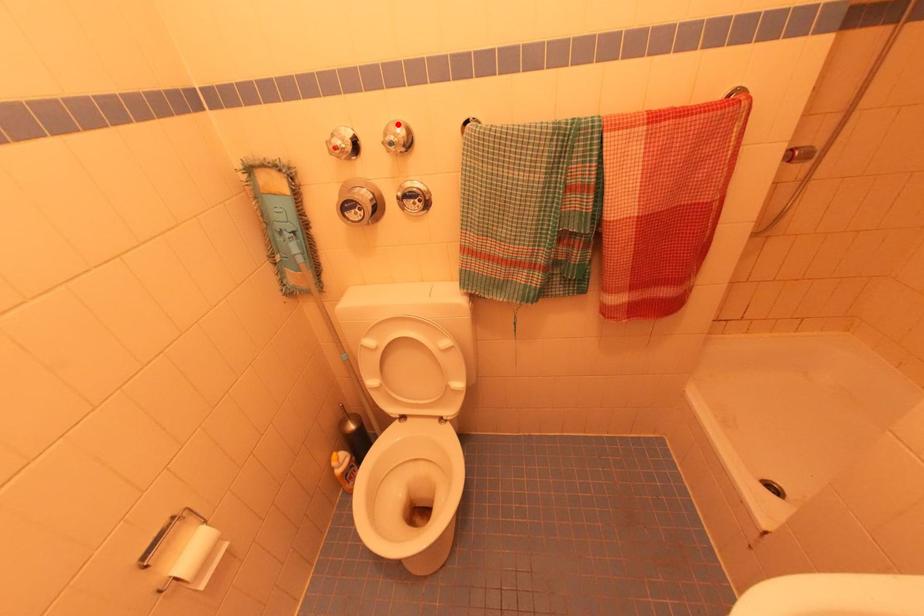
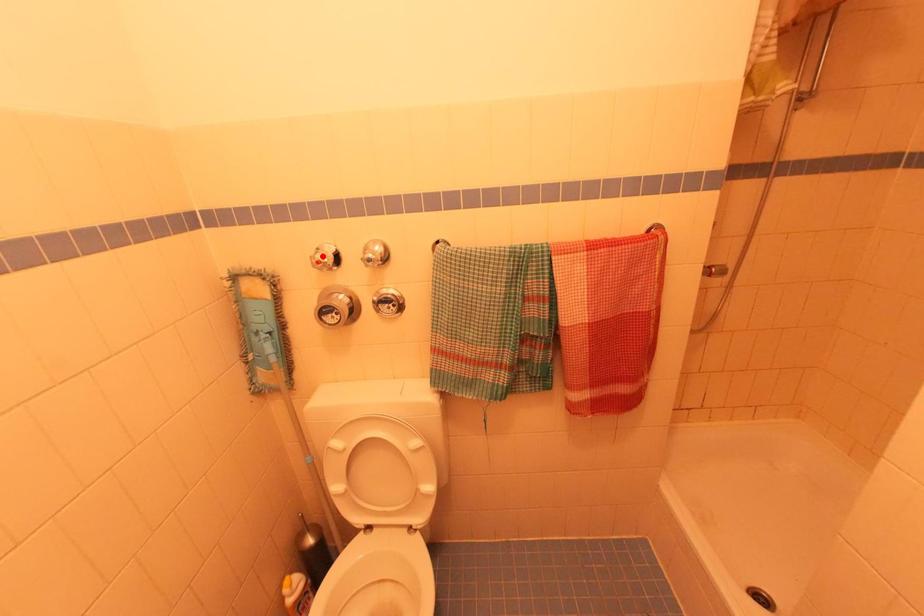
I am providing you with two images of the same scene from different viewpoints. A red point is marked on the first image and another point is marked on the second image. Is the red point in image1 aligned with the point shown in image2?

No